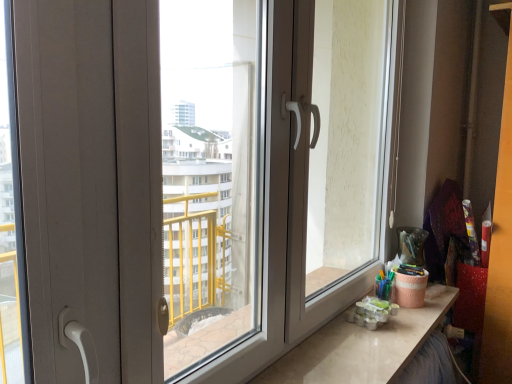
Locate an element on the screen. free space above matte white counter top at lower right (from a real-world perspective) is located at coordinates (357, 347).